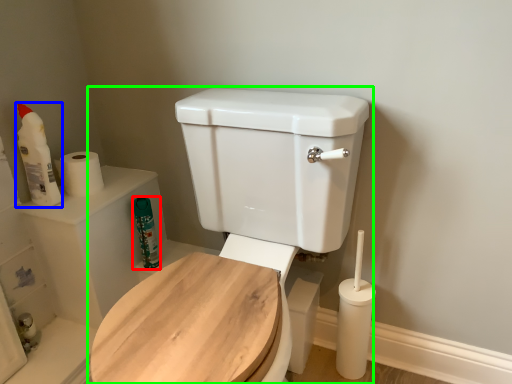
Question: Which object is positioned closest to cleaning product (highlighted by a red box)? Select from cleaning product (highlighted by a blue box) and toilet (highlighted by a green box).

Choices:
 (A) cleaning product
 (B) toilet

Answer: (A)